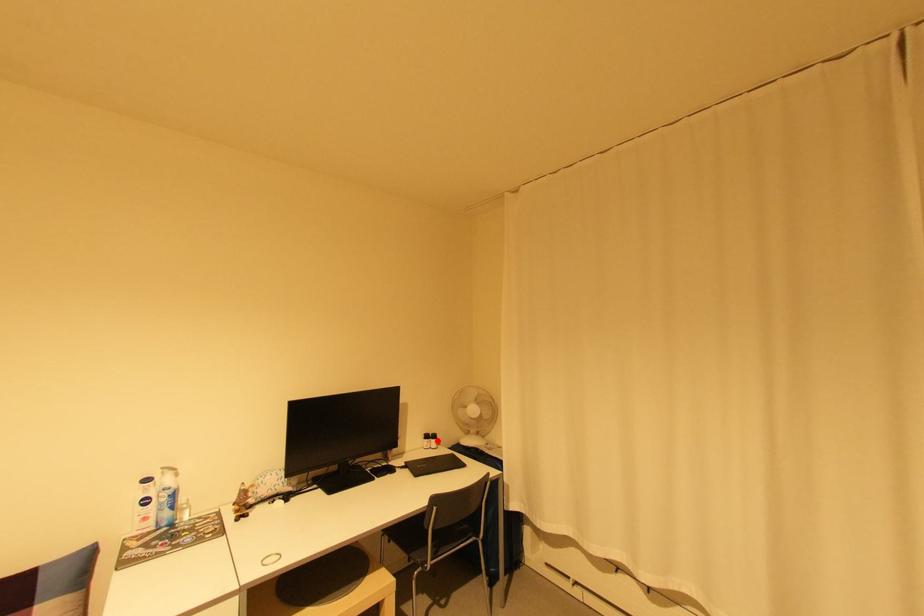
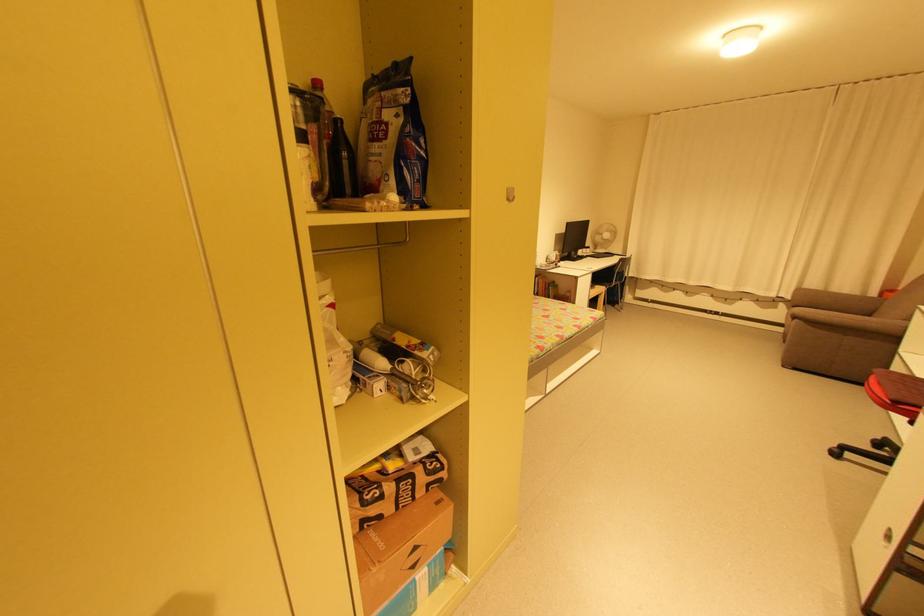
Question: I am providing you with two images of the same scene from different viewpoints. Image1 has a red point marked. In image2, the corresponding 3D location appears at what relative position? Reply with the corresponding letter.

Choices:
 (A) Closer
 (B) Farther

Answer: (A)